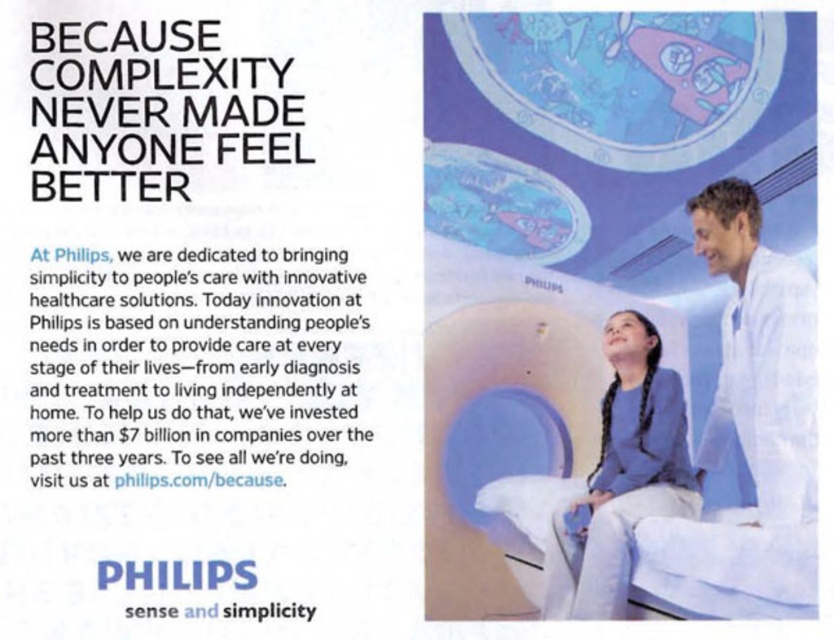
Question: Which point is closer to the camera taking this photo?

Choices:
 (A) (812, 547)
 (B) (656, 481)

Answer: (A)

Question: Does blue fabric at center appear on the left side of white fabric hospital bed at lower right?

Choices:
 (A) yes
 (B) no

Answer: (A)

Question: Which object appears closest to the camera in this image?

Choices:
 (A) blue fabric at center
 (B) white fabric hospital bed at lower right

Answer: (B)

Question: Is blue fabric at center further to camera compared to white fabric hospital bed at lower right?

Choices:
 (A) yes
 (B) no

Answer: (A)

Question: Observing the image, what is the correct spatial positioning of blue fabric at center in reference to white fabric hospital bed at lower right?

Choices:
 (A) left
 (B) right

Answer: (A)